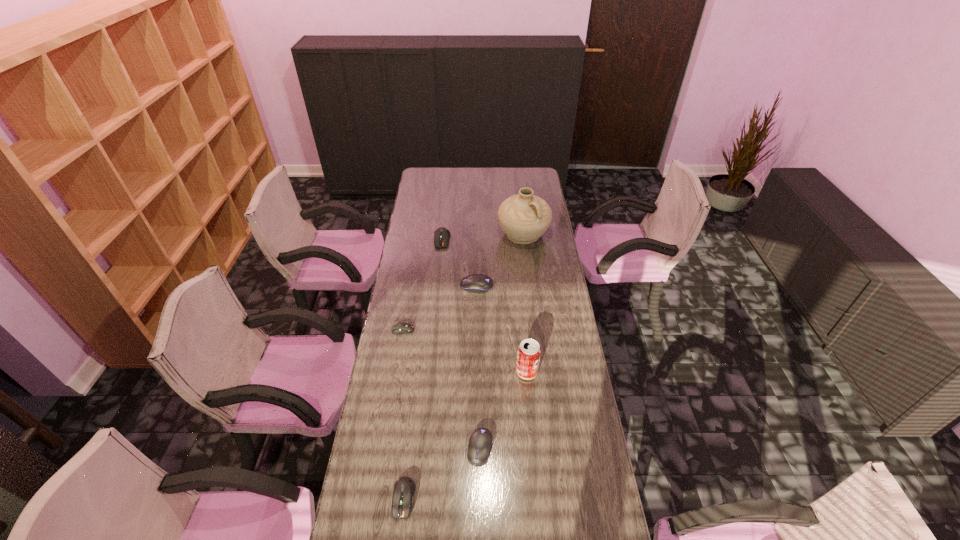
The width and height of the screenshot is (960, 540). I want to click on vacant space that satisfies the following two spatial constraints: 1. on the button of the biggest dark computer equipment; 2. on the right side of the soda can, so click(428, 372).

Image resolution: width=960 pixels, height=540 pixels. Identify the location of vacant space that satisfies the following two spatial constraints: 1. on the button of the nearer black computer mouse; 2. on the right side of the second nearest dark computer equipment. (383, 448).

The image size is (960, 540). In order to click on blank area in the image that satisfies the following two spatial constraints: 1. on the button of the soda can; 2. on the left side of the fourth farthest object in this screenshot , I will do `click(396, 372)`.